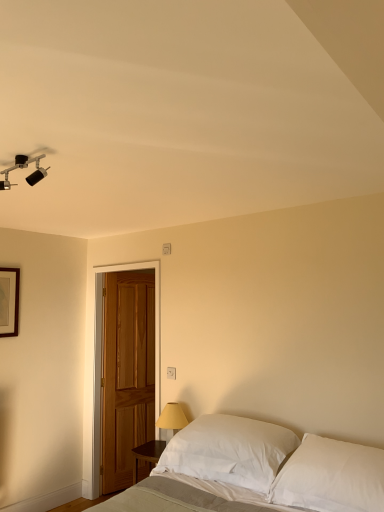
Question: From a real-world perspective, is wooden picture frame at upper left positioned over white soft bed at lower center based on gravity?

Choices:
 (A) no
 (B) yes

Answer: (B)

Question: Is wooden picture frame at upper left oriented towards white soft bed at lower center?

Choices:
 (A) yes
 (B) no

Answer: (A)

Question: Would you say wooden picture frame at upper left is a long distance from white soft bed at lower center?

Choices:
 (A) no
 (B) yes

Answer: (B)

Question: Does wooden picture frame at upper left appear on the left side of white soft bed at lower center?

Choices:
 (A) no
 (B) yes

Answer: (B)

Question: Is wooden picture frame at upper left taller than white soft bed at lower center?

Choices:
 (A) no
 (B) yes

Answer: (B)

Question: In the image, is white plastic electric outlet at center positioned in front of or behind white cotton pillow at lower right, which ranks as the first pillow in right-to-left order?

Choices:
 (A) front
 (B) behind

Answer: (B)

Question: Is white plastic electric outlet at center taller or shorter than white cotton pillow at lower right, which ranks as the first pillow in right-to-left order?

Choices:
 (A) tall
 (B) short

Answer: (B)

Question: In terms of width, does white plastic electric outlet at center look wider or thinner when compared to white cotton pillow at lower right, which ranks as the first pillow in right-to-left order?

Choices:
 (A) thin
 (B) wide

Answer: (A)

Question: Is point (173, 374) positioned closer to the camera than point (324, 505)?

Choices:
 (A) farther
 (B) closer

Answer: (A)

Question: Is white soft bed at lower center to the left or to the right of wooden door at left in the image?

Choices:
 (A) left
 (B) right

Answer: (B)

Question: Considering the positions of point (213, 465) and point (94, 267), is point (213, 465) closer or farther from the camera than point (94, 267)?

Choices:
 (A) farther
 (B) closer

Answer: (B)

Question: Is white soft bed at lower center in front of or behind wooden door at left in the image?

Choices:
 (A) front
 (B) behind

Answer: (A)

Question: Considering the positions of white soft bed at lower center and wooden door at left in the image, is white soft bed at lower center wider or thinner than wooden door at left?

Choices:
 (A) thin
 (B) wide

Answer: (B)

Question: From a real-world perspective, is wooden picture frame at upper left physically located above or below matte black track light at upper left?

Choices:
 (A) below
 (B) above

Answer: (A)

Question: Considering the positions of wooden picture frame at upper left and matte black track light at upper left in the image, is wooden picture frame at upper left wider or thinner than matte black track light at upper left?

Choices:
 (A) wide
 (B) thin

Answer: (B)